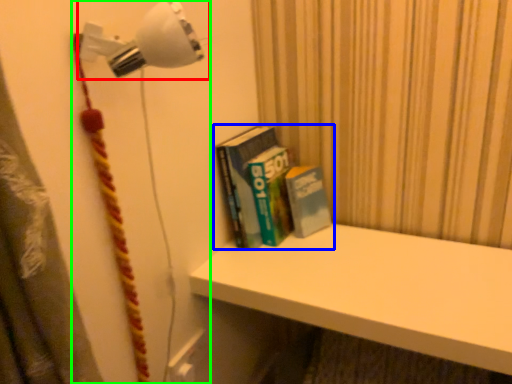
Question: Based on their relative distances, which object is nearer to lamp (highlighted by a red box)? Choose from book (highlighted by a blue box) and lamp (highlighted by a green box).

Choices:
 (A) book
 (B) lamp

Answer: (B)